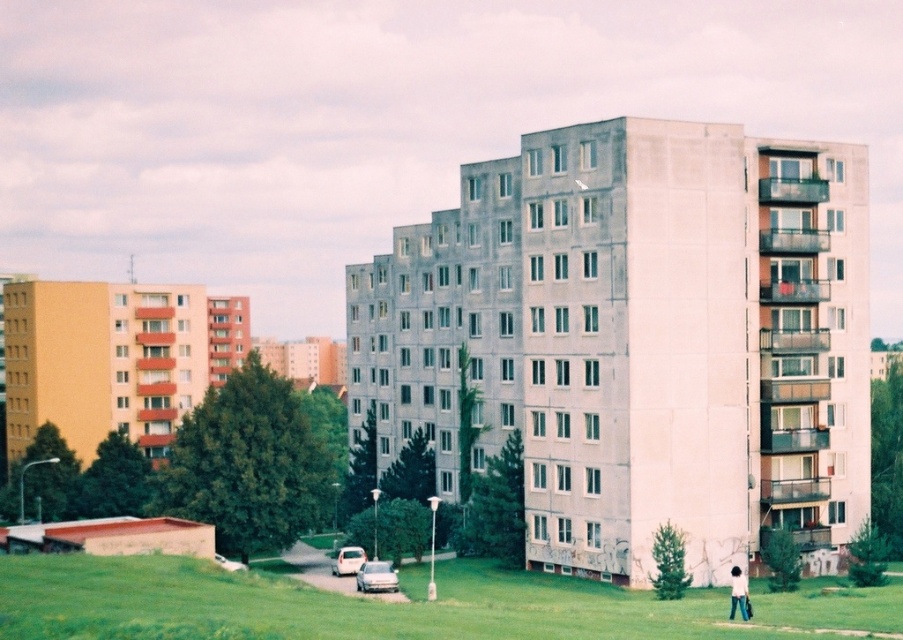
Question: Which point is farther to the camera?

Choices:
 (A) green grass at lower center
 (B) light brown hair at lower right

Answer: (B)

Question: Is green grass at lower center smaller than light brown hair at lower right?

Choices:
 (A) yes
 (B) no

Answer: (B)

Question: Which point is closer to the camera?

Choices:
 (A) green grass at lower center
 (B) light brown hair at lower right

Answer: (A)

Question: Can you confirm if green grass at lower center is thinner than light brown hair at lower right?

Choices:
 (A) yes
 (B) no

Answer: (B)

Question: Where is green grass at lower center located in relation to light brown hair at lower right in the image?

Choices:
 (A) below
 (B) above

Answer: (B)

Question: Among these objects, which one is farthest from the camera?

Choices:
 (A) green grass at lower center
 (B) light brown hair at lower right

Answer: (B)